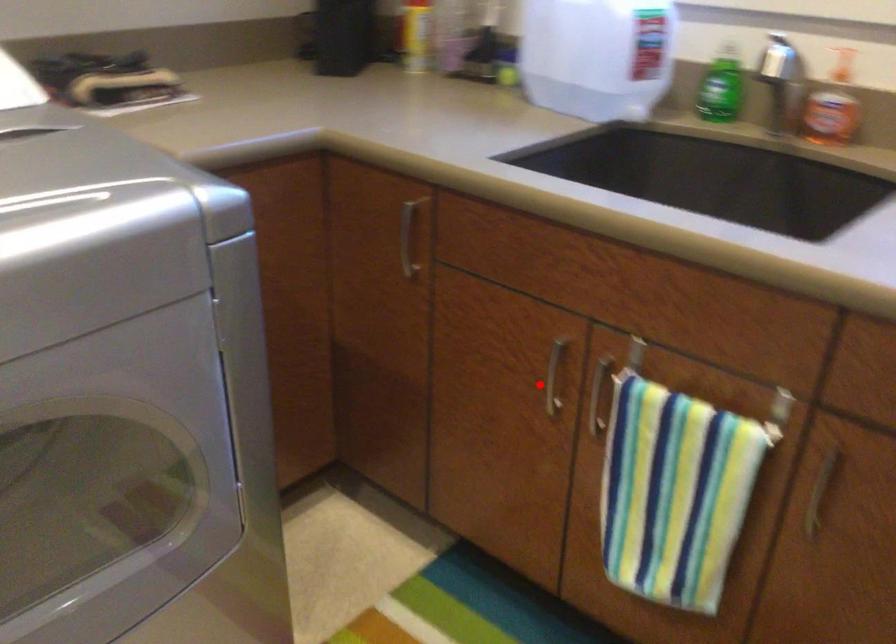
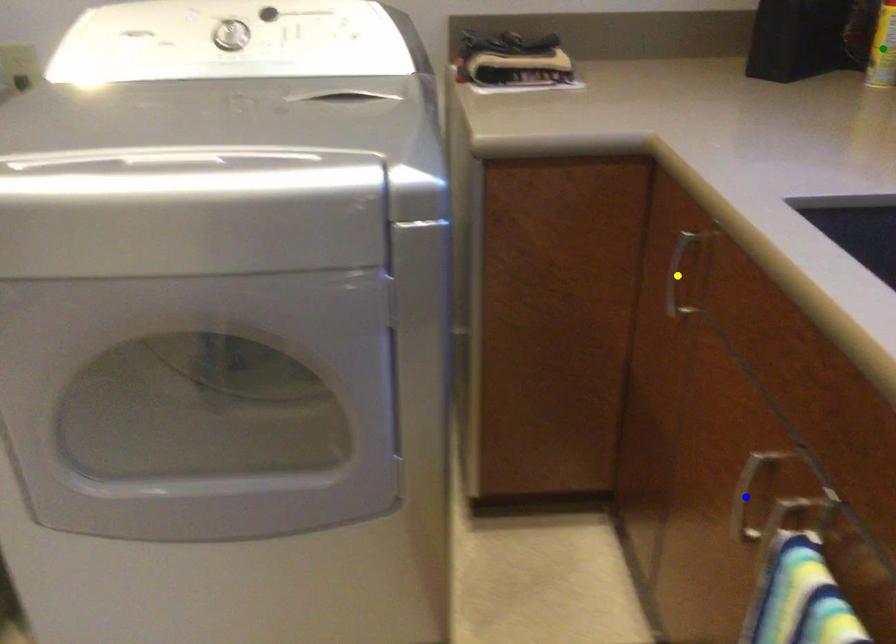
Question: I am providing you with two images of the same scene from different viewpoints. A red point is marked on the first image. You are given multiple points on the second image. Which spot in image 2 lines up with the point in image 1?

Choices:
 (A) green point
 (B) yellow point
 (C) blue point

Answer: (C)